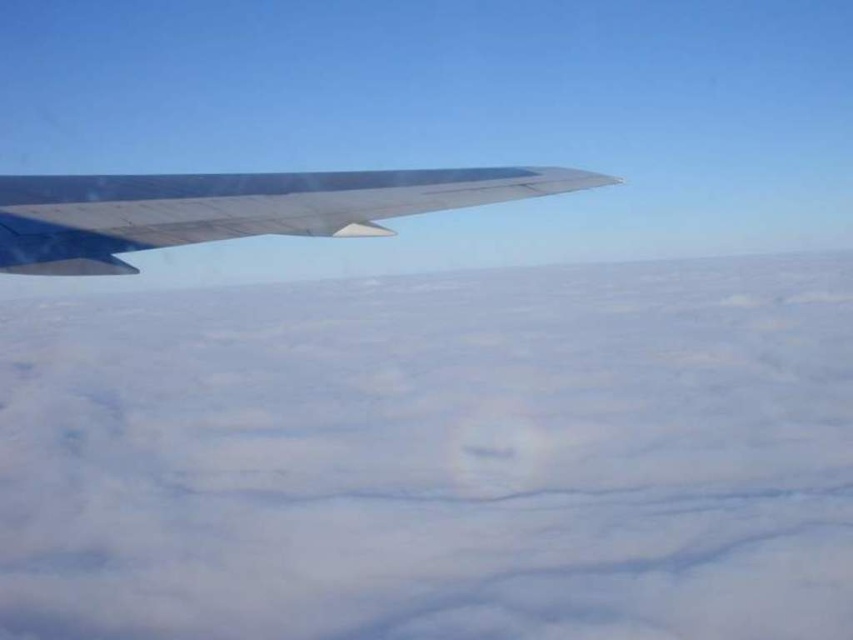
You are a passenger sitting by the window on an airplane. You notice two objects outside your window, the white fluffy cloud at upper left and the metallic gray wing at upper left. Which object is closer to the airplane?

The metallic gray wing at upper left is closer to the airplane because it is below the white fluffy cloud at upper left, meaning the wing is in front of the cloud from the observer perspective.

You are a flight attendant on an airplane. You look out the window and see the white fluffy cloud at upper left and the metallic gray wing at upper left. Which object is bigger in size?

The white fluffy cloud at upper left has a larger size compared to the metallic gray wing at upper left, so the white fluffy cloud at upper left is bigger.

You are a passenger sitting in the airplane and looking out the window. You notice two points marked on the wing and the clouds below. Which point, point [569,564] or point [471,188], is closer to your eyes?

Point [471,188] is closer to your eyes because it is less further to the camera than point [569,564].